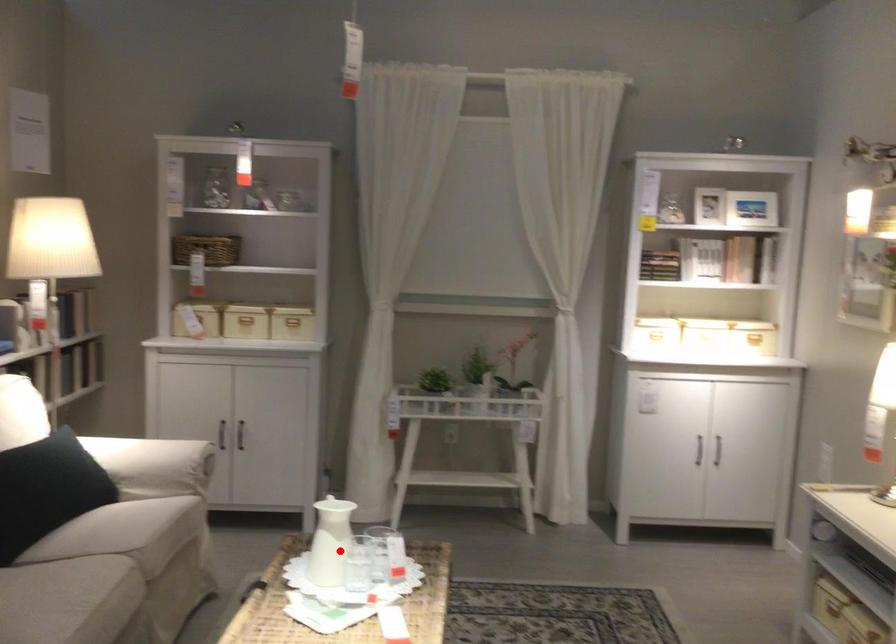
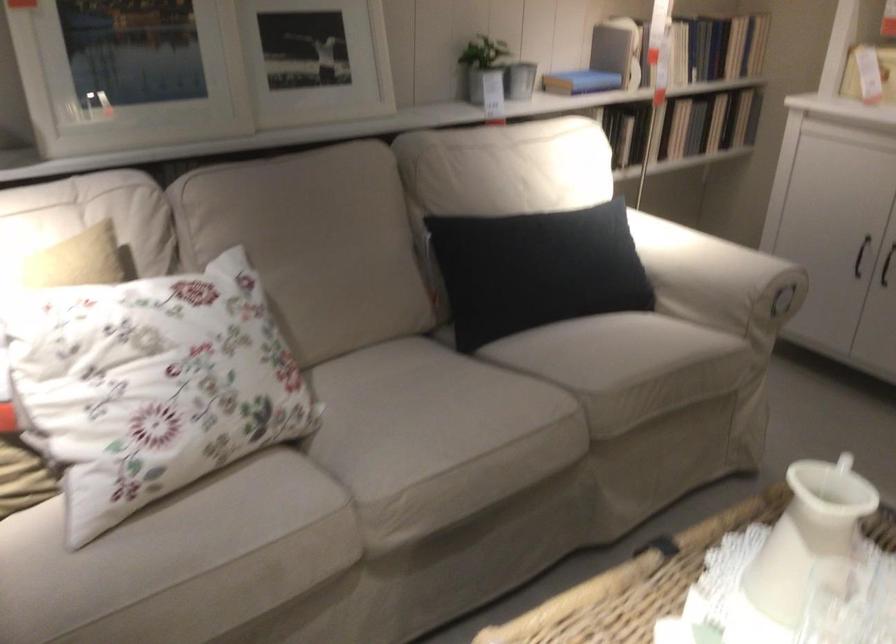
Locate, in the second image, the point that corresponds to the highlighted location in the first image.

(803, 552)